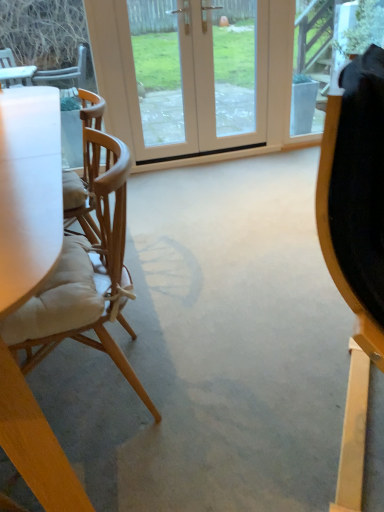
Measure the distance between light beige fabric chair at left and camera.

They are 34.93 inches apart.

The height and width of the screenshot is (512, 384). Identify the location of light beige fabric chair at left. (84, 277).

The width and height of the screenshot is (384, 512). What do you see at coordinates (84, 277) in the screenshot?
I see `light beige fabric chair at left` at bounding box center [84, 277].

In order to face white glossy door at center, should I rotate leftwards or rightwards?

It's best to rotate right around 2.148 degrees.

Where is `white glossy door at center`? The width and height of the screenshot is (384, 512). white glossy door at center is located at coordinates (204, 78).

What do you see at coordinates (204, 78) in the screenshot? I see `white glossy door at center` at bounding box center [204, 78].

Where is `light beige fabric chair at left`? This screenshot has height=512, width=384. light beige fabric chair at left is located at coordinates (84, 277).

Between light beige fabric chair at left and white glossy door at center, which one appears on the left side from the viewer's perspective?

light beige fabric chair at left is more to the left.

Is the position of light beige fabric chair at left less distant than that of white glossy door at center?

Yes, it is.

Which is less distant, (59, 274) or (223, 81)?

Point (59, 274).

From the image's perspective, which one is positioned lower, light beige fabric chair at left or white glossy door at center?

From the image's view, light beige fabric chair at left is below.

From a real-world perspective, who is located higher, light beige fabric chair at left or white glossy door at center?

white glossy door at center, from a real-world perspective.

Does light beige fabric chair at left have a greater width compared to white glossy door at center?

Indeed, light beige fabric chair at left has a greater width compared to white glossy door at center.

Based on the photo, who is taller, light beige fabric chair at left or white glossy door at center?

Standing taller between the two is white glossy door at center.

Consider the image. Considering the relative sizes of light beige fabric chair at left and white glossy door at center in the image provided, is light beige fabric chair at left bigger than white glossy door at center?

Yes, light beige fabric chair at left is bigger than white glossy door at center.

Is light beige fabric chair at left positioned beyond the bounds of white glossy door at center?

Yes, light beige fabric chair at left is not within white glossy door at center.

Is light beige fabric chair at left not near white glossy door at center?

Yes, light beige fabric chair at left is far from white glossy door at center.

Is white glossy door at center at the back of light beige fabric chair at left?

No, light beige fabric chair at left is not facing the opposite direction of white glossy door at center.

How different are the orientations of light beige fabric chair at left and white glossy door at center in degrees?

87.8 degrees.

Where is `door on the right of light beige fabric chair at left`? door on the right of light beige fabric chair at left is located at coordinates (204, 78).

Can you confirm if white glossy door at center is positioned to the left of light beige fabric chair at left?

In fact, white glossy door at center is to the right of light beige fabric chair at left.

Which object is closer to the camera, white glossy door at center or light beige fabric chair at left?

light beige fabric chair at left.

Is point (228, 96) closer or farther from the camera than point (85, 298)?

Point (228, 96) is farther from the camera than point (85, 298).

From the image's perspective, which is below, white glossy door at center or light beige fabric chair at left?

light beige fabric chair at left appears lower in the image.

From a real-world perspective, is white glossy door at center above or below light beige fabric chair at left?

Clearly, from a real-world perspective, white glossy door at center is above light beige fabric chair at left.

Does white glossy door at center have a greater width compared to light beige fabric chair at left?

No, white glossy door at center is not wider than light beige fabric chair at left.

Is white glossy door at center taller or shorter than light beige fabric chair at left?

white glossy door at center is taller than light beige fabric chair at left.

Can you confirm if white glossy door at center is smaller than light beige fabric chair at left?

Indeed, white glossy door at center has a smaller size compared to light beige fabric chair at left.

Is white glossy door at center not within light beige fabric chair at left?

Yes, white glossy door at center is outside of light beige fabric chair at left.

Looking at this image, is there a large distance between white glossy door at center and light beige fabric chair at left?

Yes, white glossy door at center is far from light beige fabric chair at left.

Is white glossy door at center aimed at light beige fabric chair at left?

Yes, white glossy door at center is aimed at light beige fabric chair at left.

How different are the orientations of white glossy door at center and light beige fabric chair at left in degrees?

There is a 87.8-degree angle between the facing directions of white glossy door at center and light beige fabric chair at left.

You are a GUI agent. You are given a task and a screenshot of the screen. Output one action in this format:
    pyautogui.click(x=<x>, y=<y>)
    Task: Click on the chair in front of the white glossy door at center
    The height and width of the screenshot is (512, 384).
    Given the screenshot: What is the action you would take?
    pyautogui.click(x=84, y=277)

In order to click on chair located underneath the white glossy door at center (from a real-world perspective) in this screenshot , I will do `click(84, 277)`.

At what (x,y) coordinates should I click in order to perform the action: click on chair in front of the white glossy door at center. Please return your answer as a coordinate pair (x, y). Image resolution: width=384 pixels, height=512 pixels. Looking at the image, I should click on (84, 277).